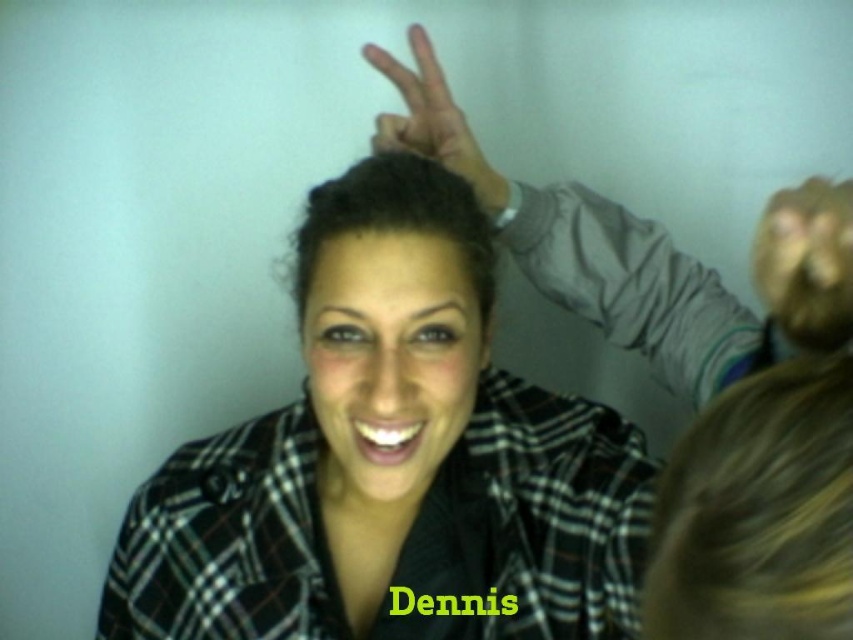
You are a photographer trying to capture the scene described. You notice two hands making a peace sign at the upper center of the image. Which hand, the matte gray hand at upper center or the matte skin hand at upper center, is on the right side?

The matte gray hand at upper center is positioned on the right side of the matte skin hand at upper center.

You are trying to determine if the plaid shirt at center can fully cover the matte skin hand at upper center when placed over it. Based on the size comparison provided, what is your conclusion?

The plaid shirt at center is larger in size than the matte skin hand at upper center, so it can fully cover the matte skin hand at upper center when placed over it.

You are trying to take a photo of both hands making a peace sign. Based on the scene, which hand is closer to the camera between the matte gray hand at upper center and the matte skin hand at upper center?

The matte gray hand at upper center is closer to the camera because it is in front of the matte skin hand at upper center.